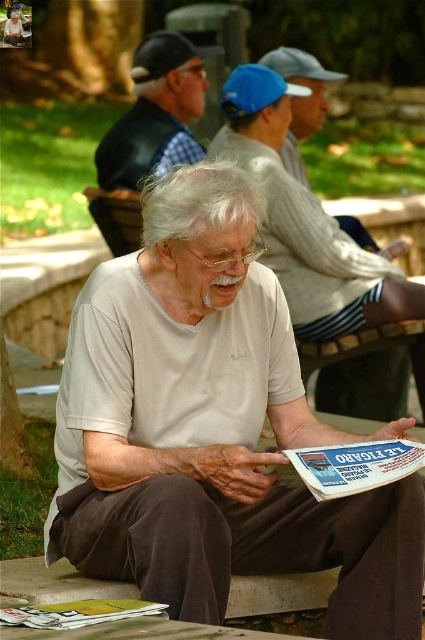
Is white matte shirt at center taller than checkered fabric vest at upper left?

Yes, white matte shirt at center is taller than checkered fabric vest at upper left.

Does white matte shirt at center come behind checkered fabric vest at upper left?

No, it is not.

Does point (303, 340) come farther from viewer compared to point (147, 90)?

No, it is not.

The width and height of the screenshot is (425, 640). In order to click on white matte shirt at center in this screenshot , I will do `click(306, 221)`.

Does white matte shirt at center have a lesser height compared to yellow glossy magazine at lower left?

No, white matte shirt at center is not shorter than yellow glossy magazine at lower left.

Is white matte shirt at center thinner than yellow glossy magazine at lower left?

No, white matte shirt at center is not thinner than yellow glossy magazine at lower left.

Who is more forward, (280, 196) or (161, 611)?

Point (161, 611)

Find the location of `white matte shirt at center`. white matte shirt at center is located at coordinates (306, 221).

Between white cotton shirt at center and checkered fabric vest at upper left, which one is positioned lower?

white cotton shirt at center is below.

Does white cotton shirt at center have a larger size compared to checkered fabric vest at upper left?

No, white cotton shirt at center is not bigger than checkered fabric vest at upper left.

The height and width of the screenshot is (640, 425). What are the coordinates of `white cotton shirt at center` in the screenshot? It's located at (212, 429).